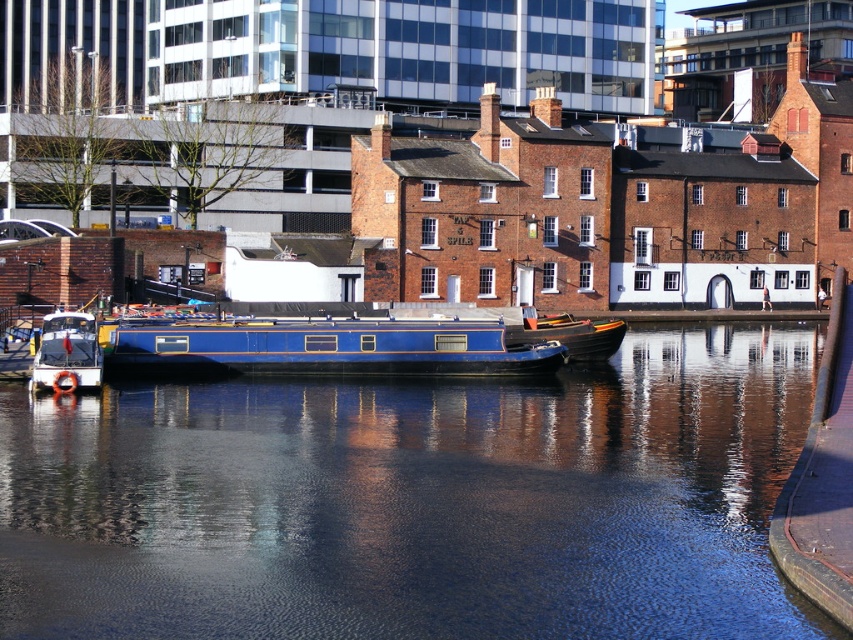
You are standing at the edge of the canal in the urban waterfront scene. There are two points marked on the water surface. Which point is closer to you, point at coordinates (514,506) or point at coordinates (572,323)?

Point at coordinates (514,506) is closer to you than point at coordinates (572,323).